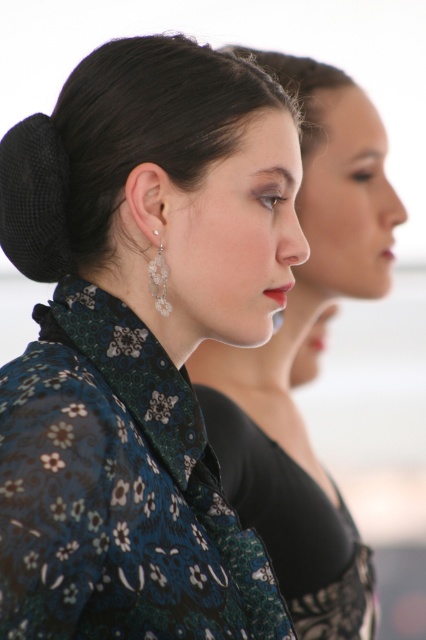
Question: Which of the following is the closest to the observer?

Choices:
 (A) [166, 122]
 (B) [103, 330]
 (C) [314, 145]
 (D) [276, 540]

Answer: (B)

Question: Is black netted bun at upper center positioned behind floral-patterned fabric dress at center?

Choices:
 (A) yes
 (B) no

Answer: (B)

Question: From the image, what is the correct spatial relationship of black netted bun at upper center in relation to black textured hair at center?

Choices:
 (A) below
 (B) above

Answer: (A)

Question: Which object is closer to the camera taking this photo?

Choices:
 (A) black textured hair at center
 (B) floral-patterned fabric dress at center
 (C) black netted bun at upper center
 (D) matte floral-patterned blouse at center

Answer: (C)

Question: Where is floral-patterned fabric dress at center located in relation to black textured hair at center in the image?

Choices:
 (A) right
 (B) left

Answer: (A)

Question: Which point is farther to the camera?

Choices:
 (A) matte floral-patterned blouse at center
 (B) black netted bun at upper center
 (C) black textured hair at center
 (D) floral-patterned fabric at center

Answer: (C)